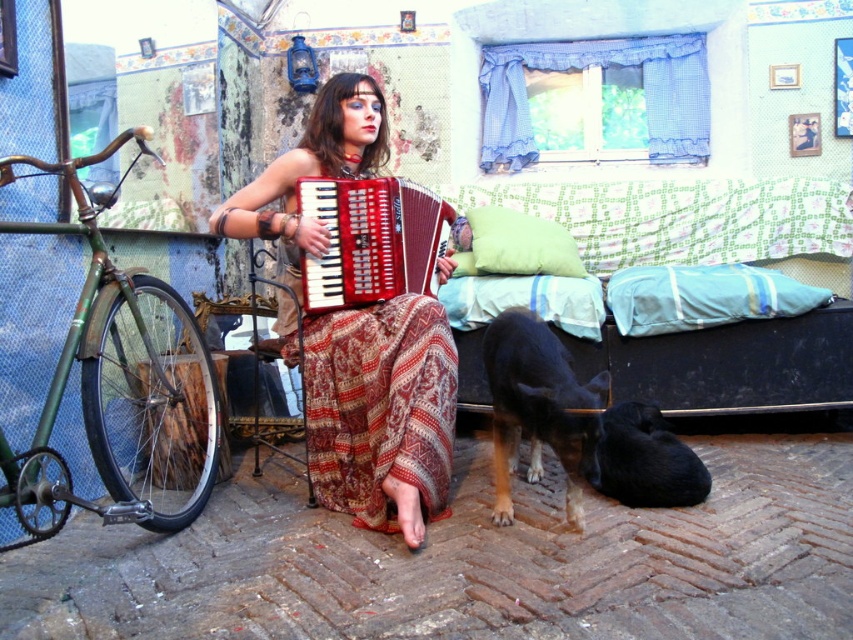
Question: Does matte red accordion at center have a greater width compared to red glossy accordion at center?

Choices:
 (A) yes
 (B) no

Answer: (A)

Question: Can you confirm if green matte bicycle at left is positioned above black fur dog at lower right?

Choices:
 (A) yes
 (B) no

Answer: (A)

Question: Does matte red accordion at center appear on the left side of brown fur dog at lower center?

Choices:
 (A) yes
 (B) no

Answer: (A)

Question: Which of the following is the farthest from the observer?

Choices:
 (A) (312, 262)
 (B) (566, 452)
 (C) (613, 436)

Answer: (C)

Question: Which object is the farthest from the brown fur dog at lower center?

Choices:
 (A) red glossy accordion at center
 (B) green matte bicycle at left
 (C) matte red accordion at center
 (D) black fur dog at lower right

Answer: (B)

Question: Which point appears farthest from the camera in this image?

Choices:
 (A) tap(332, 234)
 (B) tap(599, 456)
 (C) tap(540, 396)

Answer: (A)